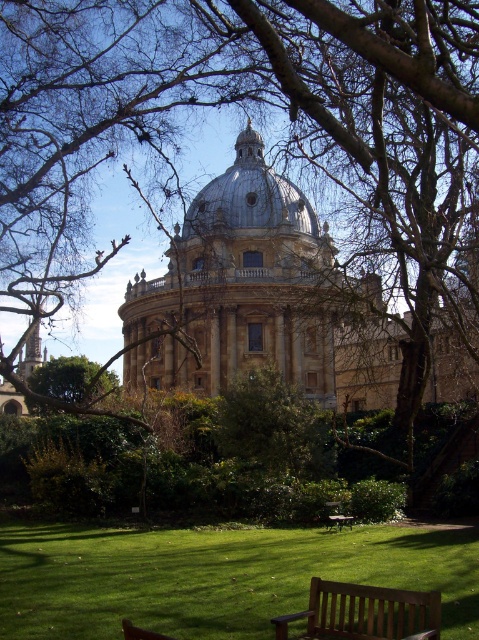
Who is shorter, golden stone dome at center or wooden bench at lower center?

With less height is wooden bench at lower center.

Does golden stone dome at center have a greater width compared to wooden bench at lower center?

Indeed, golden stone dome at center has a greater width compared to wooden bench at lower center.

Is point (271, 173) positioned after point (388, 609)?

That is True.

This screenshot has width=479, height=640. In order to click on golden stone dome at center in this screenshot , I will do `click(261, 296)`.

Does white stone dome at center have a greater height compared to brown wooden bench at lower center?

Yes.

Does point (283, 211) come in front of point (334, 502)?

No, (283, 211) is behind (334, 502).

The width and height of the screenshot is (479, 640). Describe the element at coordinates (249, 196) in the screenshot. I see `white stone dome at center` at that location.

The width and height of the screenshot is (479, 640). Identify the location of white stone dome at center. (249, 196).

Which is behind, point (376, 618) or point (332, 502)?

The point (332, 502) is more distant.

Who is more distant from viewer, [432,632] or [323,506]?

Point [323,506]

Locate an element on the screen. This screenshot has width=479, height=640. wooden bench at lower center is located at coordinates (365, 612).